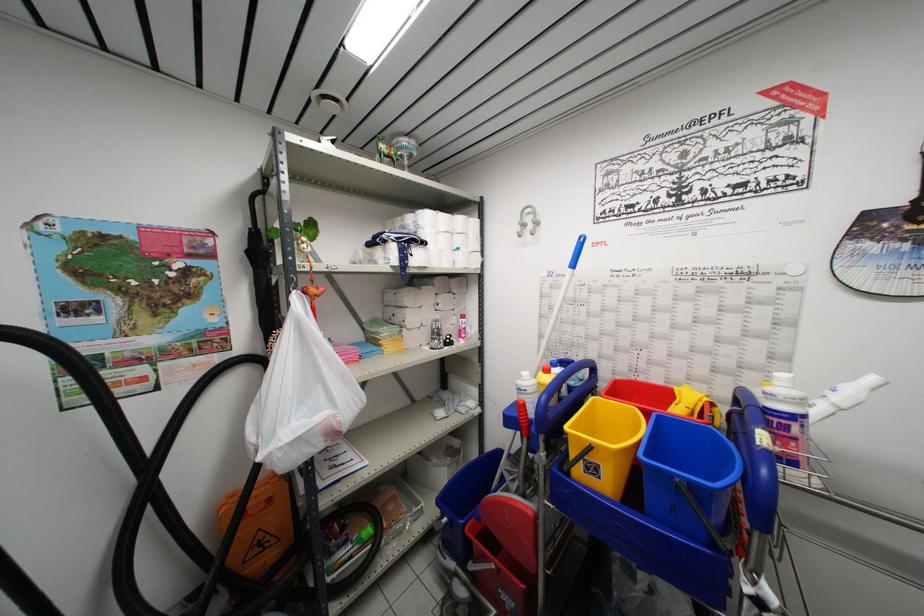
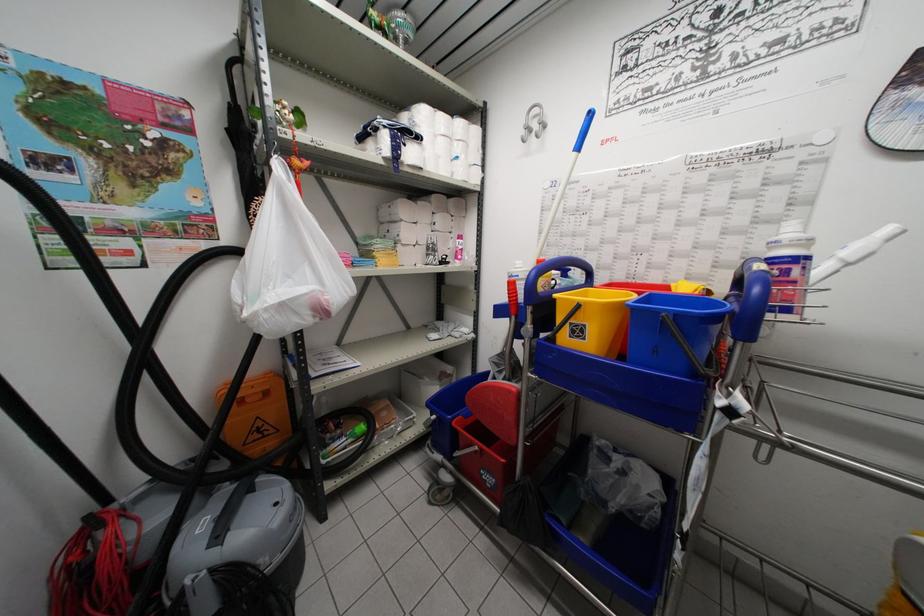
Question: Based on the continuous images, in which direction is the camera rotating? Reply with the corresponding letter.

Choices:
 (A) Left
 (B) Right
 (C) Up
 (D) Down

Answer: (D)